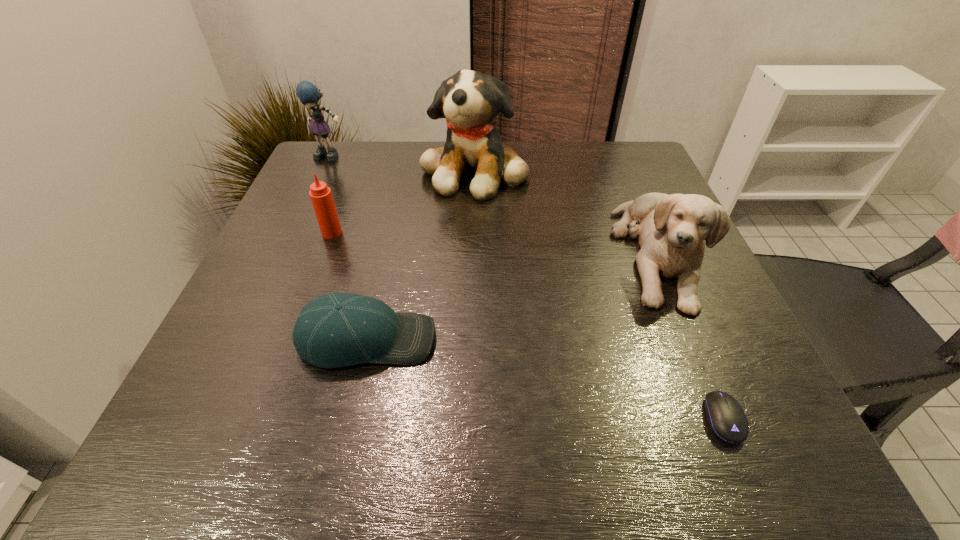
This screenshot has height=540, width=960. Identify the location of free location at the far right corner of the desktop. (640, 189).

At what (x,y) coordinates should I click in order to perform the action: click on vacant space that's between the nearest object and the leftmost object. Please return your answer as a coordinate pair (x, y). The height and width of the screenshot is (540, 960). Looking at the image, I should click on (527, 288).

The height and width of the screenshot is (540, 960). I want to click on free space between the fourth shortest object and the baseball cap, so click(x=512, y=297).

The image size is (960, 540). What are the coordinates of `free space between the Tabasco sauce and the second shortest object` in the screenshot? It's located at (349, 286).

At what (x,y) coordinates should I click in order to perform the action: click on vacant area between the tallest object and the baseball cap. Please return your answer as a coordinate pair (x, y). Looking at the image, I should click on (420, 255).

Where is `free area in between the fifth tallest object and the right puppy`? Image resolution: width=960 pixels, height=540 pixels. free area in between the fifth tallest object and the right puppy is located at coordinates (512, 297).

Where is `free space between the shortest object and the Tabasco sauce`? The height and width of the screenshot is (540, 960). free space between the shortest object and the Tabasco sauce is located at coordinates (527, 326).

This screenshot has height=540, width=960. What are the coordinates of `empty space that is in between the third shortest object and the fifth tallest object` in the screenshot? It's located at (349, 286).

This screenshot has height=540, width=960. Identify the location of free space that is in between the fifth tallest object and the third shortest object. (349, 286).

Identify which object is located as the fifth nearest to the nearer puppy. Please provide its 2D coordinates. Your answer should be formatted as a tuple, i.e. [(x, y)], where the tuple contains the x and y coordinates of a point satisfying the conditions above.

[(307, 92)]